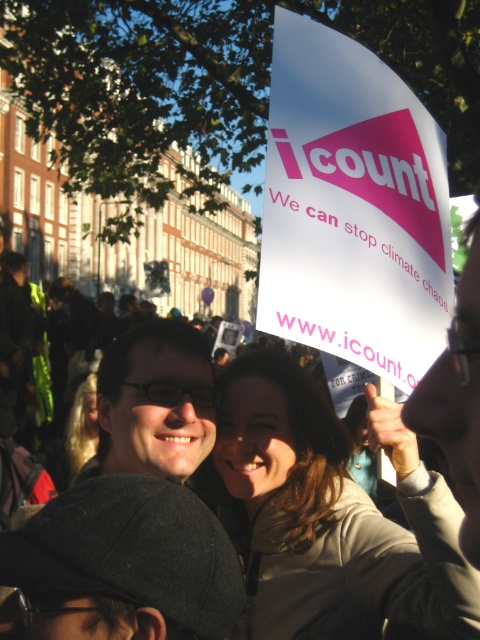
You are a photographer trying to capture a clear shot of both the matte black glasses at center and the blonde hair at lower left. Based on their positions, which object should you focus on first to ensure both are in sharp focus?

You should focus on the matte black glasses at center first since it is closer to the viewer than the blonde hair at lower left. By focusing on the closer object, the depth of field may also keep the farther object in focus.

From the picture: You are a photographer trying to capture a clear shot of both the matte beige coat at center and the blonde hair at lower left. Based on their positions, which object should you focus on first to ensure both are in the frame?

The matte beige coat at center is in front of blonde hair at lower left, so you should focus on the matte beige coat at center first to ensure both are in the frame.

You are a photographer standing in front of the matte beige coat at center and the matte black glasses at center. Which object is closer to you?

The matte beige coat at center is closer to you because it is further to the viewer than the matte black glasses at center.